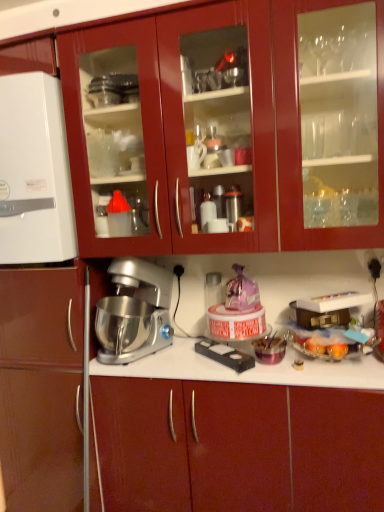
Question: Is glossy wood cabinets at upper center, arranged as the 2th cabinetry when ordered from the bottom, not near white matte refrigerator at left, the 1th appliance viewed from the left?

Choices:
 (A) yes
 (B) no

Answer: (B)

Question: Is glossy wood cabinets at upper center, the 1th cabinetry viewed from the top, further to the viewer compared to white matte refrigerator at left, which is the 2th appliance from bottom to top?

Choices:
 (A) no
 (B) yes

Answer: (A)

Question: Is glossy wood cabinets at upper center, the 1th cabinetry viewed from the top, positioned with its back to white matte refrigerator at left, which is the 2th appliance from bottom to top?

Choices:
 (A) no
 (B) yes

Answer: (A)

Question: Considering the relative sizes of glossy wood cabinets at upper center, the 1th cabinetry viewed from the top, and white matte refrigerator at left, which is counted as the 1th appliance, starting from the top, in the image provided, is glossy wood cabinets at upper center, the 1th cabinetry viewed from the top, smaller than white matte refrigerator at left, which is counted as the 1th appliance, starting from the top,?

Choices:
 (A) no
 (B) yes

Answer: (A)

Question: Would you say white matte refrigerator at left, the 1th appliance viewed from the left, is part of glossy wood cabinets at upper center, arranged as the 2th cabinetry when ordered from the bottom,'s contents?

Choices:
 (A) yes
 (B) no

Answer: (B)

Question: From a real-world perspective, is glossy wood cabinets at upper center, arranged as the 2th cabinetry when ordered from the bottom, beneath white matte refrigerator at left, which is counted as the 1th appliance, starting from the top?

Choices:
 (A) no
 (B) yes

Answer: (A)

Question: Are matte red cabinet at center, the 2th cabinetry positioned from the top, and white matte refrigerator at left, which is counted as the 1th appliance, starting from the top, making contact?

Choices:
 (A) yes
 (B) no

Answer: (B)

Question: Can you confirm if matte red cabinet at center, the 1th cabinetry in the bottom-to-top sequence, is thinner than white matte refrigerator at left, which is the 2th appliance from bottom to top?

Choices:
 (A) no
 (B) yes

Answer: (A)

Question: From the image's perspective, is matte red cabinet at center, the 2th cabinetry positioned from the top, on white matte refrigerator at left, which is the 2th appliance from bottom to top?

Choices:
 (A) no
 (B) yes

Answer: (A)

Question: Does matte red cabinet at center, the 2th cabinetry positioned from the top, have a greater width compared to white matte refrigerator at left, which is the 2th appliance from bottom to top?

Choices:
 (A) no
 (B) yes

Answer: (B)

Question: Is matte red cabinet at center, the 2th cabinetry positioned from the top, facing towards white matte refrigerator at left, which is the 2th appliance from bottom to top?

Choices:
 (A) no
 (B) yes

Answer: (A)

Question: Could white matte refrigerator at left, which is the 2th appliance from bottom to top, be considered to be inside matte red cabinet at center, the 1th cabinetry in the bottom-to-top sequence?

Choices:
 (A) no
 (B) yes

Answer: (A)

Question: Is matte red cabinet at center, the 1th cabinetry in the bottom-to-top sequence, far from silver metallic stand mixer at center?

Choices:
 (A) yes
 (B) no

Answer: (B)